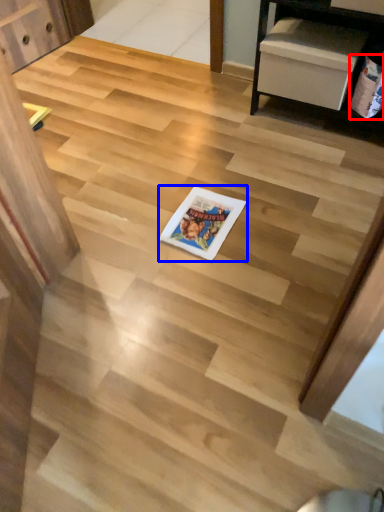
Question: Which of the following is the farthest to the observer, comic book (highlighted by a red box) or comic book (highlighted by a blue box)?

Choices:
 (A) comic book
 (B) comic book

Answer: (A)